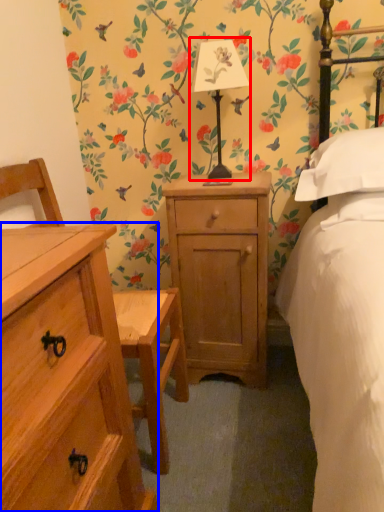
Question: Which point is further to the camera, bedside lamp (highlighted by a red box) or chest of drawers (highlighted by a blue box)?

Choices:
 (A) bedside lamp
 (B) chest of drawers

Answer: (A)